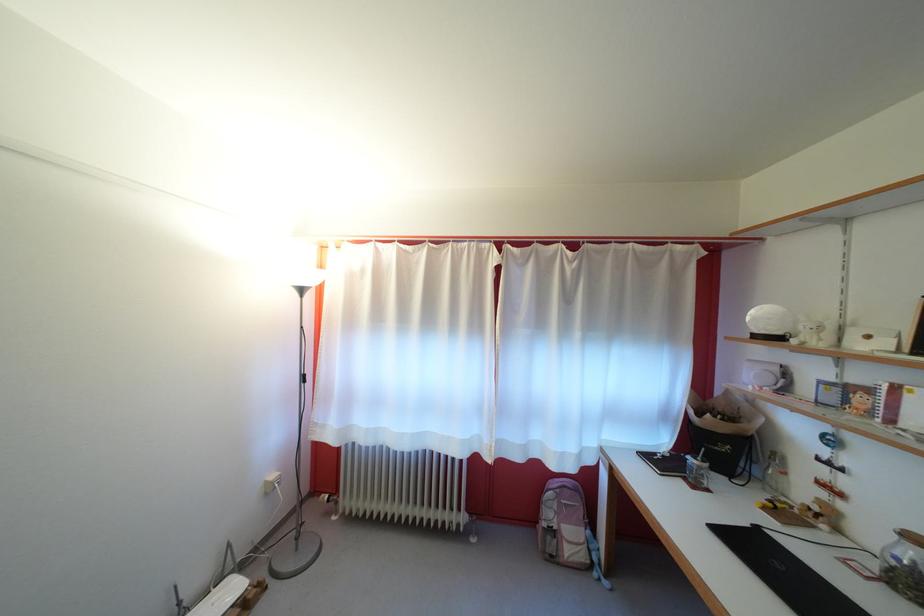
The location [904,565] corresponds to which object?

This point indicates the glass jar.